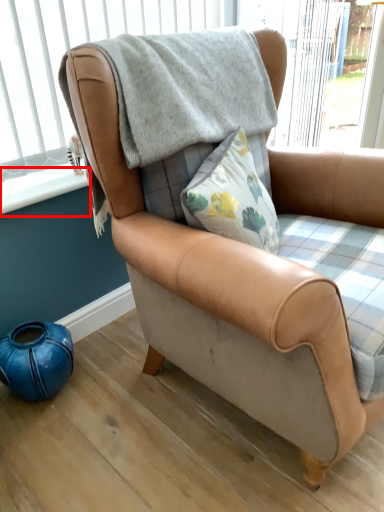
Question: Considering the relative positions of window sill (annotated by the red box) and window frame in the image provided, where is window sill (annotated by the red box) located with respect to the staircase?

Choices:
 (A) right
 (B) left

Answer: (B)